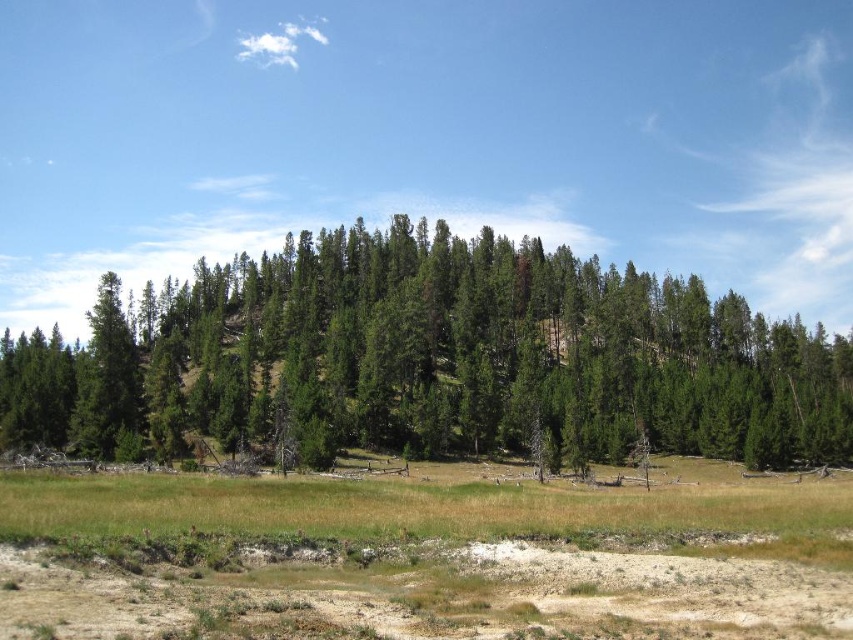
Question: Can you confirm if green matte trees at center is positioned below brown sandy dirt field at lower center?

Choices:
 (A) no
 (B) yes

Answer: (A)

Question: Where is green matte trees at center located in relation to brown sandy dirt field at lower center in the image?

Choices:
 (A) below
 (B) above

Answer: (B)

Question: Where is green matte trees at center located in relation to brown sandy dirt field at lower center in the image?

Choices:
 (A) below
 (B) above

Answer: (B)

Question: Which object appears farthest from the camera in this image?

Choices:
 (A) green matte trees at center
 (B) brown sandy dirt field at lower center

Answer: (A)

Question: Which point is farther to the camera?

Choices:
 (A) (543, 358)
 (B) (636, 563)

Answer: (A)

Question: Which point is closer to the camera?

Choices:
 (A) (102, 444)
 (B) (679, 515)

Answer: (B)